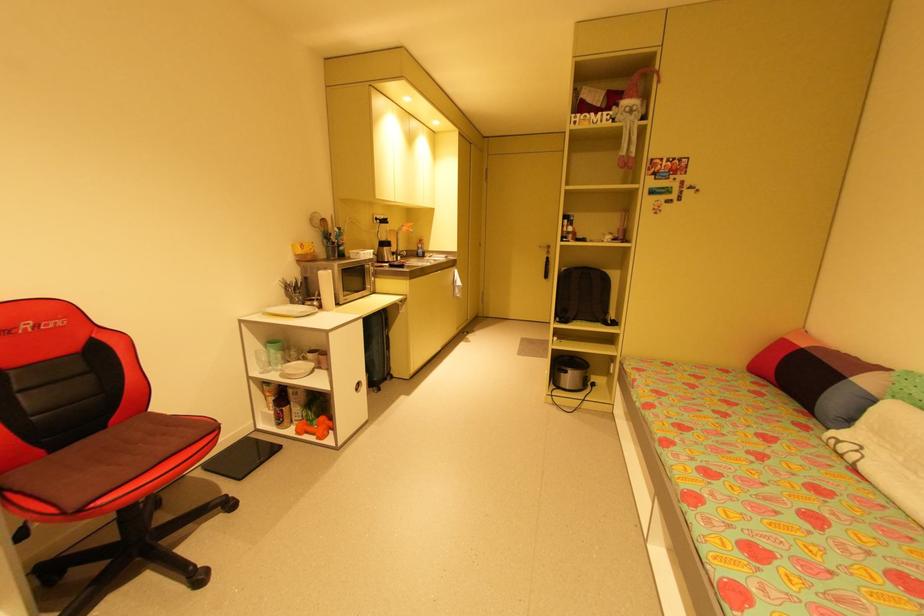
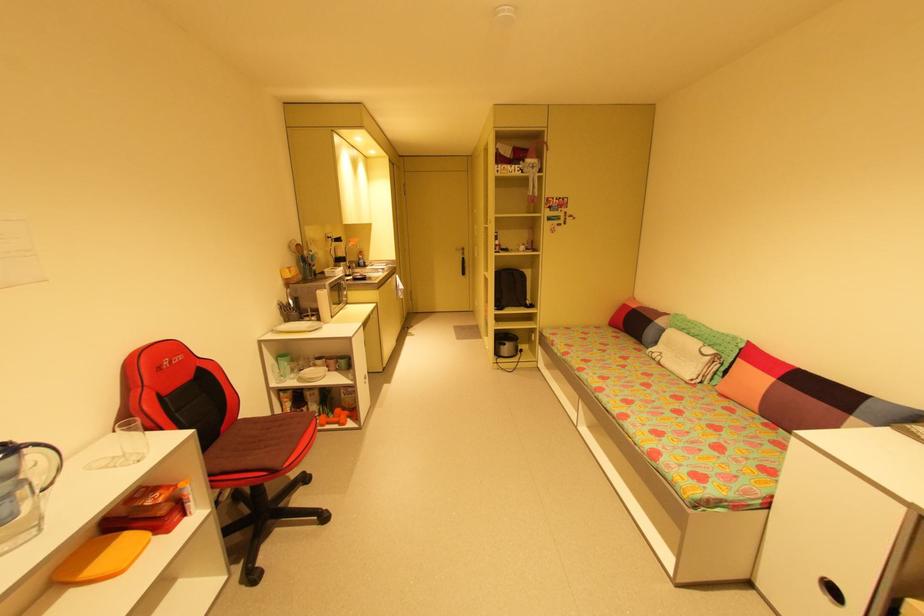
Locate, in the second image, the point that corresponds to point (543, 246) in the first image.

(460, 249)